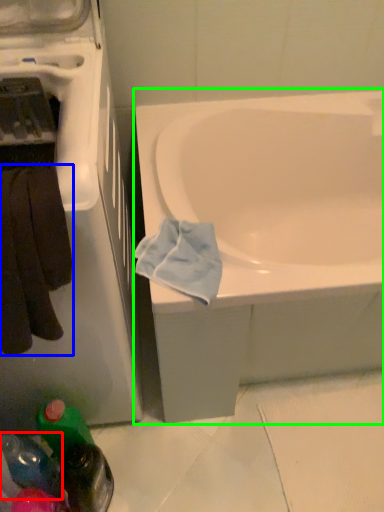
Question: Considering the real-world distances, which object is closest to bottle (highlighted by a red box)? towel/napkin (highlighted by a blue box) or bathtub (highlighted by a green box).

Choices:
 (A) towel/napkin
 (B) bathtub

Answer: (A)